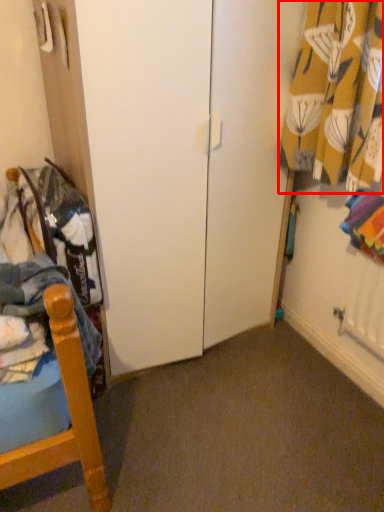
Question: From the image's perspective, where is curtain (annotated by the red box) located in relation to clothing in the image?

Choices:
 (A) below
 (B) above

Answer: (B)